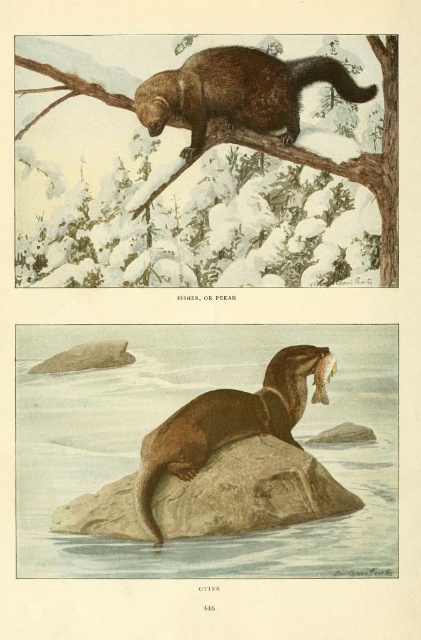
You are a GUI agent. You are given a task and a screenshot of the screen. Output one action in this format:
    pyautogui.click(x=<x>, y=<y>)
    Task: Click on the brown rock at center
    
    Given the screenshot: What is the action you would take?
    pyautogui.click(x=250, y=492)

Locate an element on the screen. brown rock at center is located at coordinates (250, 492).

Between brown glossy water at center and smooth brown fur at upper center, which one appears on the left side from the viewer's perspective?

Positioned to the left is brown glossy water at center.

Does brown glossy water at center lie in front of smooth brown fur at upper center?

That is True.

Is point (352, 561) behind point (394, 84)?

No, (352, 561) is closer to viewer.

At what (x,y) coordinates should I click in order to perform the action: click on brown glossy water at center. Please return your answer as a coordinate pair (x, y). The width and height of the screenshot is (421, 640). Looking at the image, I should click on click(207, 452).

Is brown furry beaver at upper center smaller than smooth brown fur at upper center?

Yes.

Who is more forward, [264,56] or [61,99]?

Point [61,99]

Is point (212, 104) less distant than point (237, 134)?

Yes, it is in front of point (237, 134).

Locate an element on the screen. brown furry beaver at upper center is located at coordinates (237, 92).